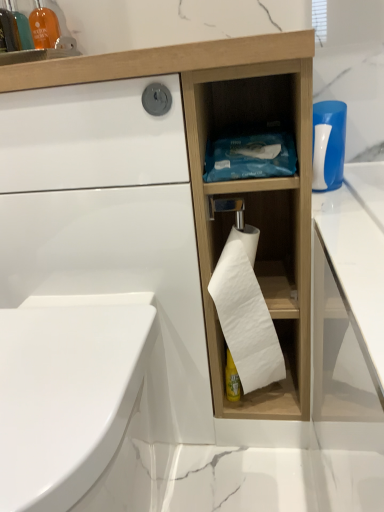
Question: Could you tell me if white plastic bottle at upper right is turned towards matte orange glass at upper left?

Choices:
 (A) yes
 (B) no

Answer: (B)

Question: Is matte orange glass at upper left inside white plastic bottle at upper right?

Choices:
 (A) yes
 (B) no

Answer: (B)

Question: Can you confirm if white plastic bottle at upper right is taller than matte orange glass at upper left?

Choices:
 (A) no
 (B) yes

Answer: (A)

Question: Is white plastic bottle at upper right not close to matte orange glass at upper left?

Choices:
 (A) no
 (B) yes

Answer: (A)

Question: Is the position of white plastic bottle at upper right more distant than that of matte orange glass at upper left?

Choices:
 (A) yes
 (B) no

Answer: (B)

Question: Considering the relative sizes of white plastic bottle at upper right and matte orange glass at upper left in the image provided, is white plastic bottle at upper right smaller than matte orange glass at upper left?

Choices:
 (A) yes
 (B) no

Answer: (A)

Question: Is white plastic bottle at upper right shorter than white matte toilet paper at center?

Choices:
 (A) no
 (B) yes

Answer: (B)

Question: Is white plastic bottle at upper right thinner than white matte toilet paper at center?

Choices:
 (A) yes
 (B) no

Answer: (A)

Question: From the image's perspective, is white plastic bottle at upper right over white matte toilet paper at center?

Choices:
 (A) yes
 (B) no

Answer: (A)

Question: Is white plastic bottle at upper right closer to camera compared to white matte toilet paper at center?

Choices:
 (A) yes
 (B) no

Answer: (B)

Question: Is white plastic bottle at upper right taller than white matte toilet paper at center?

Choices:
 (A) no
 (B) yes

Answer: (A)

Question: Is white matte toilet paper at center surrounded by white plastic bottle at upper right?

Choices:
 (A) yes
 (B) no

Answer: (B)

Question: Are translucent orange bottle at upper left and white glossy bidet at lower left located far from each other?

Choices:
 (A) yes
 (B) no

Answer: (B)